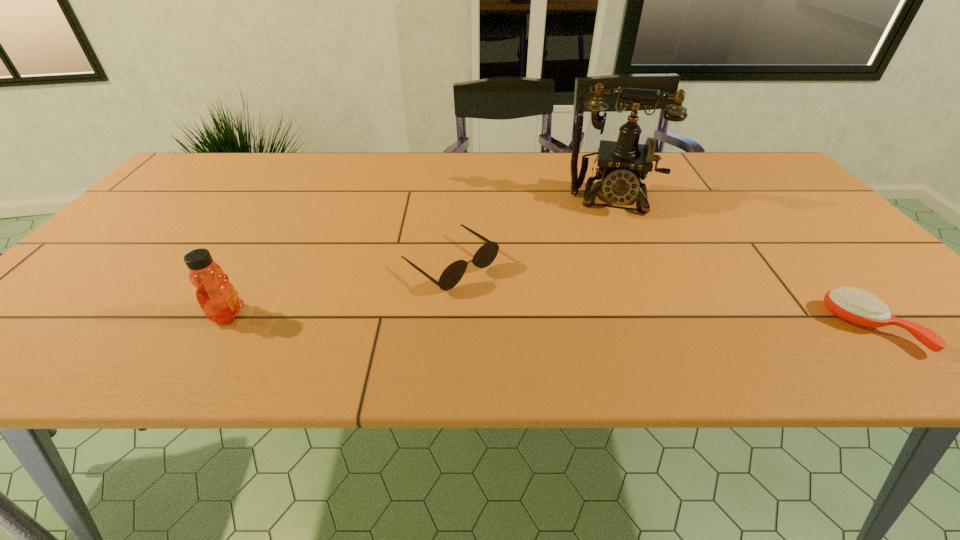
Image resolution: width=960 pixels, height=540 pixels. I want to click on free space between the leftmost object and the shortest object, so click(x=550, y=321).

Where is `free space that is in between the farthest object and the rightmost object`? Image resolution: width=960 pixels, height=540 pixels. free space that is in between the farthest object and the rightmost object is located at coordinates (742, 264).

I want to click on vacant area between the third shortest object and the third object from left to right, so click(x=420, y=257).

You are a GUI agent. You are given a task and a screenshot of the screen. Output one action in this format:
    pyautogui.click(x=<x>, y=<y>)
    Task: Click on the free space that is in between the tallest object and the sunglasses
    
    Given the screenshot: What is the action you would take?
    pyautogui.click(x=532, y=232)

Locate an element on the screen. the closest object to the sunglasses is located at coordinates (623, 164).

Where is `object that can be found as the second closest to the leftmost object`? The height and width of the screenshot is (540, 960). object that can be found as the second closest to the leftmost object is located at coordinates (623, 164).

Identify the location of blank area in the image that satisfies the following two spatial constraints: 1. on the front side of the third nearest object; 2. on the right side of the hairbrush. (446, 328).

Locate an element on the screen. The width and height of the screenshot is (960, 540). blank space that satisfies the following two spatial constraints: 1. on the back side of the third object from left to right; 2. on the right side of the third nearest object is located at coordinates (456, 200).